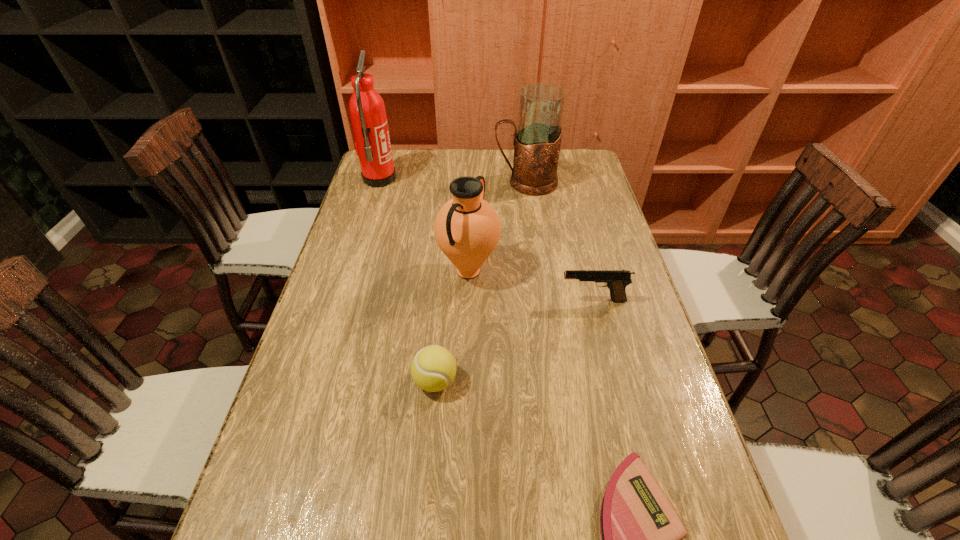
Locate an element on the screen. Image resolution: width=960 pixels, height=540 pixels. the tallest object is located at coordinates click(367, 110).

This screenshot has height=540, width=960. I want to click on fire extinguisher, so click(367, 110).

I want to click on the farther pitcher, so [x=537, y=139].

Where is `the fourth nearest object`? The width and height of the screenshot is (960, 540). the fourth nearest object is located at coordinates (467, 229).

Where is `the fourth farthest object`? This screenshot has width=960, height=540. the fourth farthest object is located at coordinates [616, 280].

Locate an element on the screen. This screenshot has height=540, width=960. the second nearest object is located at coordinates (433, 368).

Locate an element on the screen. This screenshot has width=960, height=540. free spot located 0.380m on the label side of the leftmost object is located at coordinates (500, 179).

Locate an element on the screen. Image resolution: width=960 pixels, height=540 pixels. vacant space located 0.280m with the handle on the side of the farther pitcher is located at coordinates pos(417,183).

Locate an element on the screen. vacant region located with the handle on the side of the farther pitcher is located at coordinates (444, 183).

In order to click on vacant space located 0.340m with the handle on the side of the farther pitcher in this screenshot , I will do [x=399, y=183].